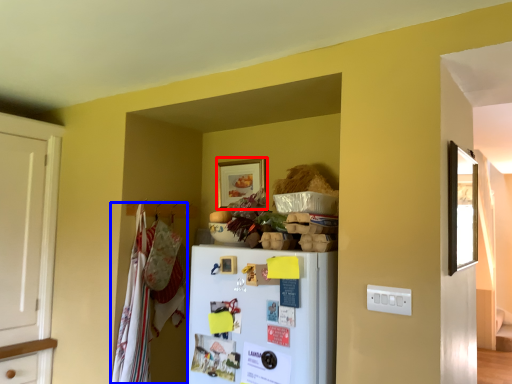
Question: Which point is closer to the camera, picture frame (highlighted by a red box) or laundry (highlighted by a blue box)?

Choices:
 (A) picture frame
 (B) laundry

Answer: (B)